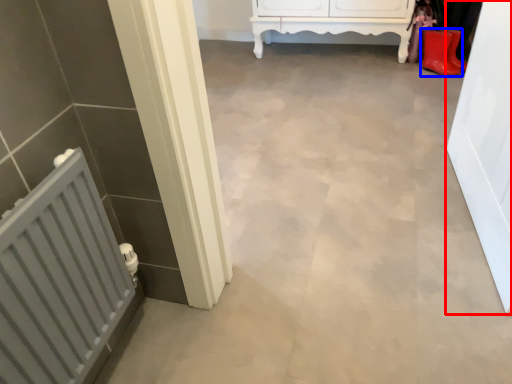
Question: Which object is further to the camera taking this photo, door (highlighted by a red box) or footwear (highlighted by a blue box)?

Choices:
 (A) door
 (B) footwear

Answer: (B)